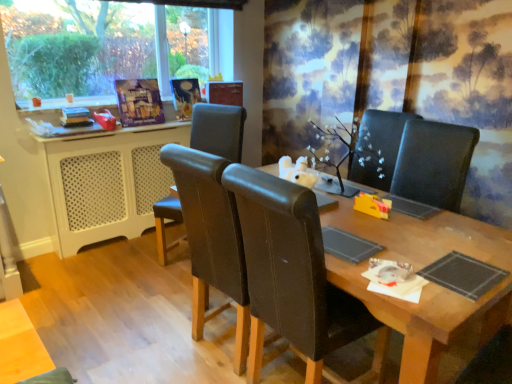
Locate an element on the screen. Image resolution: width=512 pixels, height=384 pixels. vacant space situated above white perforated plastic at left (from a real-world perspective) is located at coordinates (130, 125).